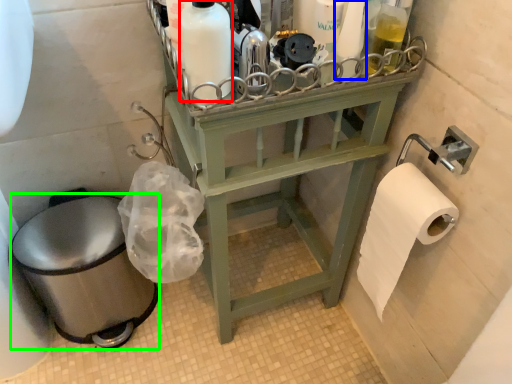
Question: Based on their relative distances, which object is farther from cleaning product (highlighted by a red box)? Choose from toiletry (highlighted by a blue box) and toilet bowl (highlighted by a green box).

Choices:
 (A) toiletry
 (B) toilet bowl

Answer: (B)